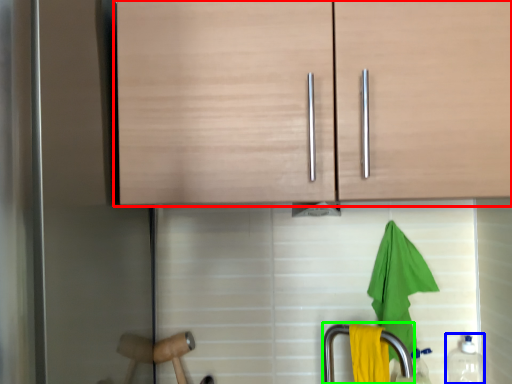
Question: Which is farther away from cabinetry (highlighted by a red box)? bottle (highlighted by a blue box) or faucet (highlighted by a green box)?

Choices:
 (A) bottle
 (B) faucet

Answer: (A)